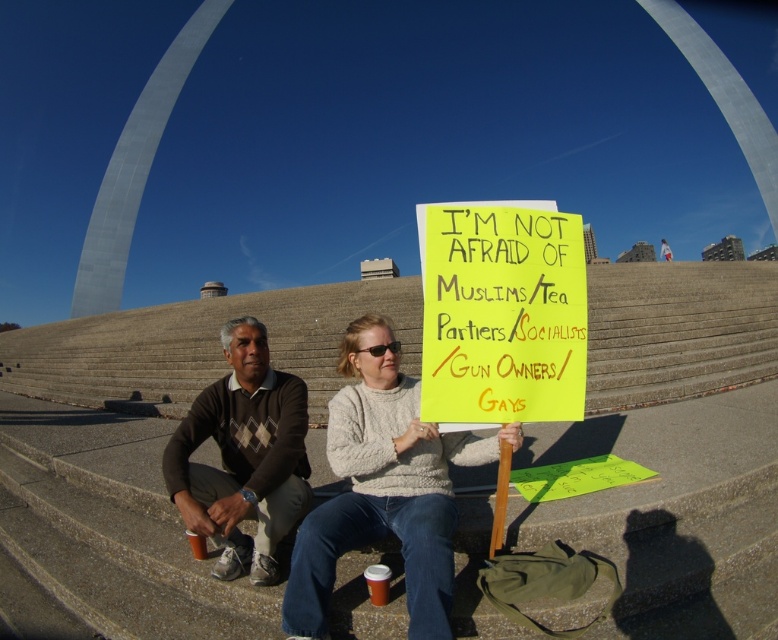
Can you confirm if knit sweater at center is positioned below brown argyle sweater at center?

Yes, knit sweater at center is below brown argyle sweater at center.

Who is more distant from viewer, (372, 340) or (279, 481)?

The point (372, 340) is behind.

Between point (398, 480) and point (232, 369), which one is positioned behind?

Point (232, 369)

Locate an element on the screen. The width and height of the screenshot is (778, 640). knit sweater at center is located at coordinates click(384, 488).